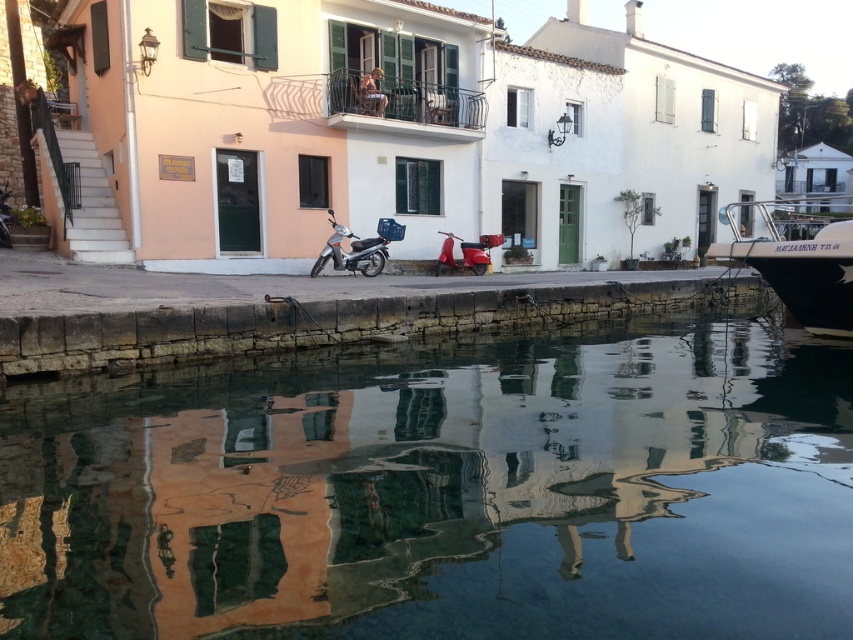
Question: Which of the following is the closest to the observer?

Choices:
 (A) metallic silver boat at right
 (B) transparent glass water at center
 (C) shiny red scooter at center

Answer: (B)

Question: Does transparent glass water at center have a smaller size compared to metallic silver scooter at center?

Choices:
 (A) yes
 (B) no

Answer: (B)

Question: Among these points, which one is nearest to the camera?

Choices:
 (A) (810, 204)
 (B) (30, 579)
 (C) (367, 262)
 (D) (490, 243)

Answer: (B)

Question: Is metallic silver scooter at center above shiny red scooter at center?

Choices:
 (A) no
 (B) yes

Answer: (A)

Question: Which object is farther from the camera taking this photo?

Choices:
 (A) transparent glass water at center
 (B) shiny red scooter at center
 (C) metallic silver boat at right
 (D) metallic silver scooter at center

Answer: (B)

Question: Does metallic silver boat at right have a smaller size compared to shiny red scooter at center?

Choices:
 (A) no
 (B) yes

Answer: (A)